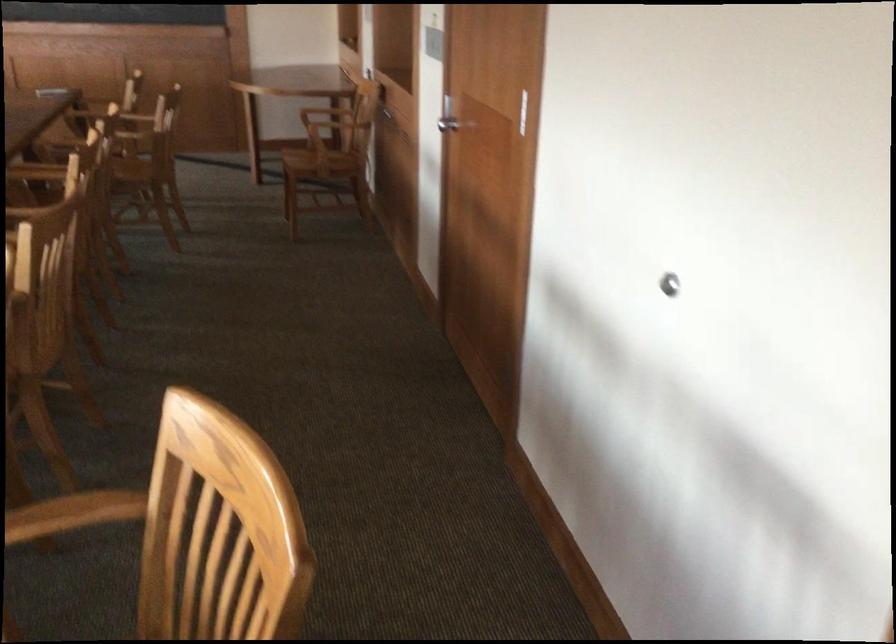
Where would you rest the chair armrest? Please return your answer as a coordinate pair (x, y).

(73, 514)